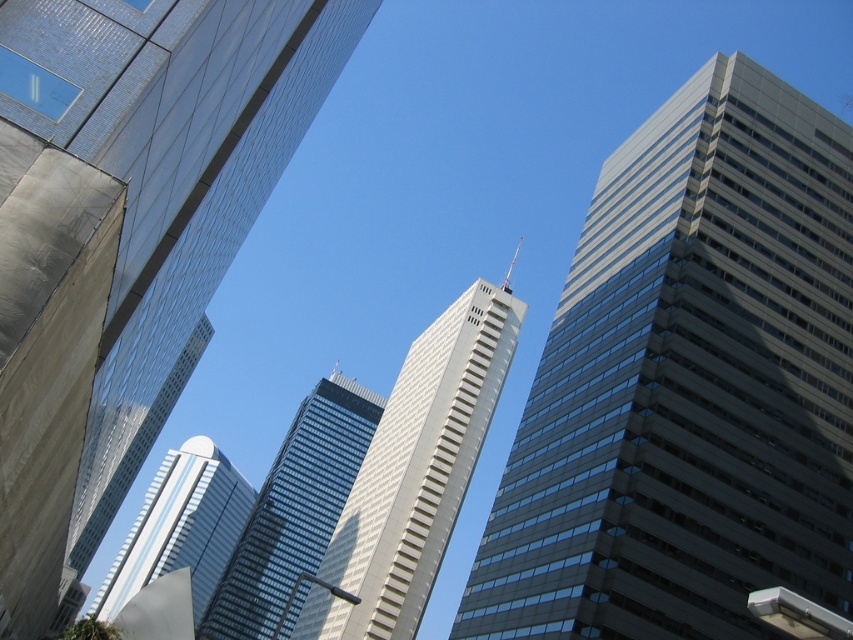
You are standing at point A, which is at the point labeled point (x=165, y=83). You want to walk to point B, which is 15.55 meters away from point A. Is the distance between point A and point B sufficient to allow a person of average height to walk comfortably without needing to bend down?

The distance between point A and point B is 15.55 meters. Since this distance is more than enough for a person of average height to walk comfortably without needing to bend down, the answer is yes.

You are a window cleaner who needs to clean the tallest glassy reflective skyscraper in the city. Based on the scene, which one should you prioritize first between the glassy reflective skyscraper at center and the glassy reflective skyscraper at lower left?

The glassy reflective skyscraper at center is taller than the glassy reflective skyscraper at lower left, so you should prioritize cleaning the glassy reflective skyscraper at center first.

You are standing in the city square and want to take a photo of both the glassy reflective skyscraper at center and the glassy reflective skyscraper at lower left. However, you notice that one of them is blocking the view of the other. Which skyscraper is blocking the other one?

The glassy reflective skyscraper at center is blocking the view of the glassy reflective skyscraper at lower left because it is positioned in front of it.